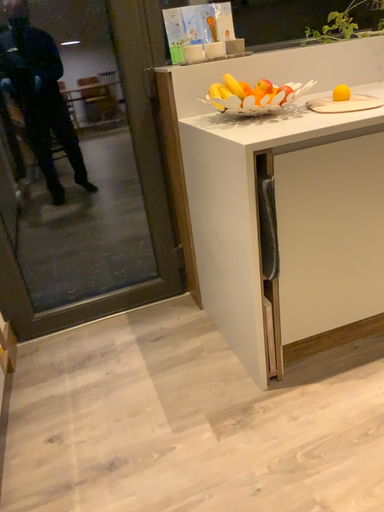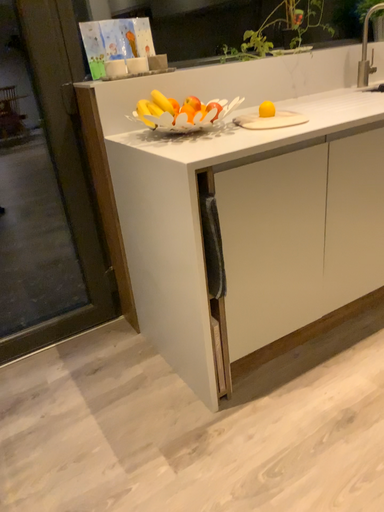
Question: Which way did the camera rotate in the video?

Choices:
 (A) rotated right
 (B) rotated left

Answer: (A)